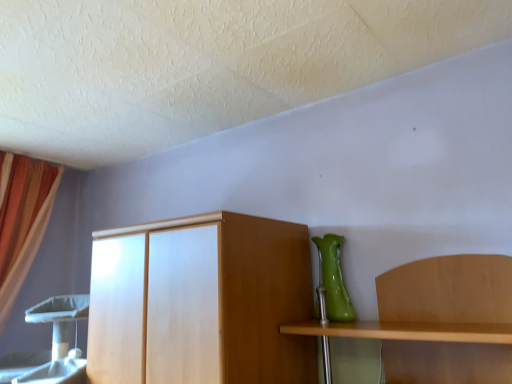
This screenshot has height=384, width=512. Describe the element at coordinates (23, 221) in the screenshot. I see `orange fabric curtain at left` at that location.

Measure the distance between point (40, 192) and camera.

Point (40, 192) is 2.47 meters from camera.

Locate an element on the screen. orange fabric curtain at left is located at coordinates (23, 221).

At what (x,y) coordinates should I click in order to perform the action: click on green glossy vase at right. Please return your answer as a coordinate pair (x, y). The height and width of the screenshot is (384, 512). Looking at the image, I should click on (334, 279).

This screenshot has width=512, height=384. Describe the element at coordinates (334, 279) in the screenshot. I see `green glossy vase at right` at that location.

Identify the location of orange fabric curtain at left. (23, 221).

Would you say green glossy vase at right is to the left or to the right of orange fabric curtain at left in the picture?

green glossy vase at right is positioned on orange fabric curtain at left's right side.

Is green glossy vase at right closer to camera compared to orange fabric curtain at left?

Yes, green glossy vase at right is closer to the camera.

Which is nearer, (322,241) or (18,242)?

→ The point (322,241) is more forward.

From the image's perspective, is green glossy vase at right positioned above or below orange fabric curtain at left?

From the image's perspective, green glossy vase at right appears above orange fabric curtain at left.

From a real-world perspective, is green glossy vase at right located beneath orange fabric curtain at left?

Yes, from a real-world perspective, green glossy vase at right is under orange fabric curtain at left.

Can you confirm if green glossy vase at right is thinner than orange fabric curtain at left?

Yes, green glossy vase at right is thinner than orange fabric curtain at left.

Does green glossy vase at right have a greater height compared to orange fabric curtain at left?

Incorrect, the height of green glossy vase at right is not larger of that of orange fabric curtain at left.

Is green glossy vase at right bigger than orange fabric curtain at left?

Actually, green glossy vase at right might be smaller than orange fabric curtain at left.

Is green glossy vase at right situated inside orange fabric curtain at left or outside?

green glossy vase at right is not enclosed by orange fabric curtain at left.

Is green glossy vase at right touching orange fabric curtain at left?

No.

Is green glossy vase at right oriented towards orange fabric curtain at left?

No, green glossy vase at right does not turn towards orange fabric curtain at left.

How many degrees apart are the facing directions of green glossy vase at right and orange fabric curtain at left?

89.4 degrees.

Find the location of a particular element. curtain behind the green glossy vase at right is located at coordinates (23, 221).

In the scene shown: Considering the relative positions of orange fabric curtain at left and green glossy vase at right in the image provided, is orange fabric curtain at left to the right of green glossy vase at right from the viewer's perspective?

No.

Is orange fabric curtain at left in front of or behind green glossy vase at right in the image?

orange fabric curtain at left is behind green glossy vase at right.

Which point is more distant from viewer, (18, 230) or (344, 297)?

The point (18, 230) is behind.

From the image's perspective, would you say orange fabric curtain at left is positioned over green glossy vase at right?

No.

From a real-world perspective, is orange fabric curtain at left located beneath green glossy vase at right?

No, from a real-world perspective, orange fabric curtain at left is not beneath green glossy vase at right.

Considering the sizes of objects orange fabric curtain at left and green glossy vase at right in the image provided, who is wider, orange fabric curtain at left or green glossy vase at right?

Wider between the two is orange fabric curtain at left.

Considering the sizes of objects orange fabric curtain at left and green glossy vase at right in the image provided, who is shorter, orange fabric curtain at left or green glossy vase at right?

green glossy vase at right.

Is orange fabric curtain at left bigger than green glossy vase at right?

Correct, orange fabric curtain at left is larger in size than green glossy vase at right.

Would you say orange fabric curtain at left is inside or outside green glossy vase at right?

orange fabric curtain at left is not enclosed by green glossy vase at right.

Are orange fabric curtain at left and green glossy vase at right beside each other?

No, orange fabric curtain at left is not touching green glossy vase at right.

Could you tell me if orange fabric curtain at left is facing green glossy vase at right?

Yes, orange fabric curtain at left faces towards green glossy vase at right.

The height and width of the screenshot is (384, 512). I want to click on vase that appears below the orange fabric curtain at left (from a real-world perspective), so click(x=334, y=279).

Where is `vase on the right of orange fabric curtain at left`? The image size is (512, 384). vase on the right of orange fabric curtain at left is located at coordinates (334, 279).

Where is `vase above the orange fabric curtain at left (from the image's perspective)`? The height and width of the screenshot is (384, 512). vase above the orange fabric curtain at left (from the image's perspective) is located at coordinates (334, 279).